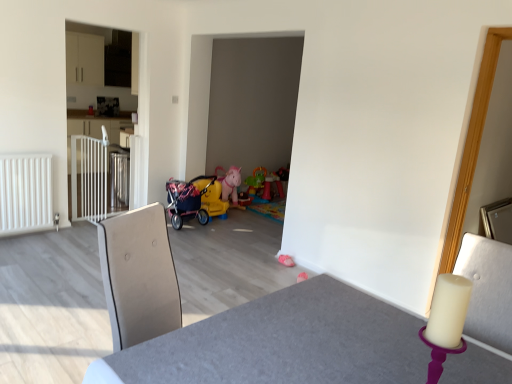
Question: Is white metallic gate at left closer to the viewer compared to plastic rainbow play table at center, which is the 1th toy in top-to-bottom order?

Choices:
 (A) yes
 (B) no

Answer: (A)

Question: Could you tell me if white metallic gate at left is facing plastic rainbow play table at center, placed as the 2th toy when sorted from bottom to top?

Choices:
 (A) yes
 (B) no

Answer: (A)

Question: Is white metallic gate at left thinner than plastic rainbow play table at center, placed as the 2th toy when sorted from bottom to top?

Choices:
 (A) no
 (B) yes

Answer: (B)

Question: Does white metallic gate at left come behind plastic rainbow play table at center, placed as the first toy when sorted from back to front?

Choices:
 (A) no
 (B) yes

Answer: (A)

Question: Is white metallic gate at left shorter than plastic rainbow play table at center, placed as the first toy when sorted from back to front?

Choices:
 (A) no
 (B) yes

Answer: (A)

Question: From the image's perspective, is white metallic gate at left on plastic rainbow play table at center, which ranks as the second toy in front-to-back order?

Choices:
 (A) no
 (B) yes

Answer: (A)

Question: From a real-world perspective, is smooth gray table at center located beneath plastic rainbow play table at center, which ranks as the second toy in front-to-back order?

Choices:
 (A) yes
 (B) no

Answer: (B)

Question: From the image's perspective, is smooth gray table at center below plastic rainbow play table at center, which ranks as the second toy in front-to-back order?

Choices:
 (A) yes
 (B) no

Answer: (A)

Question: Does smooth gray table at center have a smaller size compared to plastic rainbow play table at center, placed as the first toy when sorted from back to front?

Choices:
 (A) yes
 (B) no

Answer: (B)

Question: Would you consider smooth gray table at center to be distant from plastic rainbow play table at center, which ranks as the second toy in front-to-back order?

Choices:
 (A) no
 (B) yes

Answer: (B)

Question: Does smooth gray table at center come in front of plastic rainbow play table at center, which is the 1th toy in top-to-bottom order?

Choices:
 (A) yes
 (B) no

Answer: (A)

Question: Considering the relative sizes of smooth gray table at center and plastic rainbow play table at center, which ranks as the second toy in front-to-back order, in the image provided, is smooth gray table at center shorter than plastic rainbow play table at center, which ranks as the second toy in front-to-back order,?

Choices:
 (A) yes
 (B) no

Answer: (B)

Question: Is white glossy cabinet at left to the left of white metallic gate at left from the viewer's perspective?

Choices:
 (A) yes
 (B) no

Answer: (B)